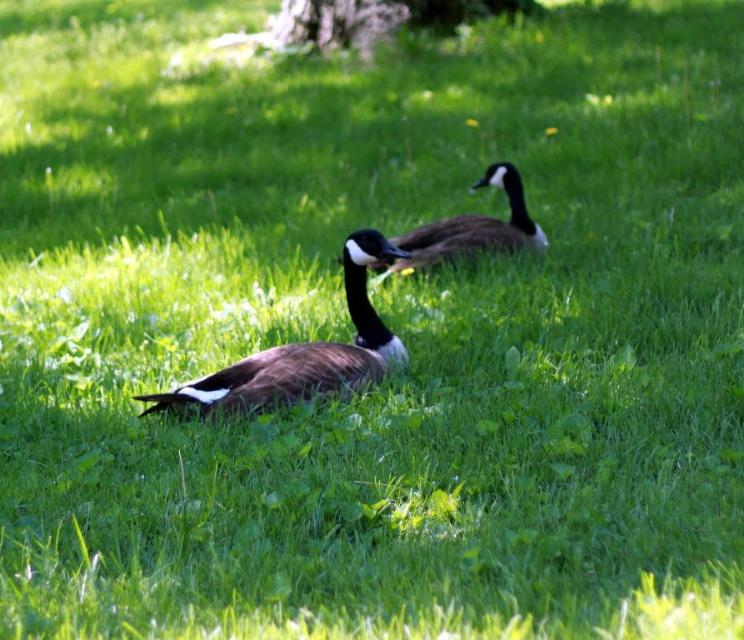
In the scene with a brown matte goose at center and a smooth bark tree at upper center, which object is positioned to the right when viewed from the front?

The smooth bark tree at upper center is positioned to the right of the brown matte goose at center.

You are a photographer trying to capture both the brown matte goose at center and the smooth bark tree at upper center in the same frame. Given that your camera can only focus on objects wider than 10 cm, will both objects meet the focus requirement?

The brown matte goose at center is thinner than the smooth bark tree at upper center. Since the camera requires objects to be wider than 10 cm, the smooth bark tree at upper center is likely wider than 10 cm. However, the brown matte goose at center being thinner might be narrower than 10 cm. Therefore, only the smooth bark tree at upper center meets the focus requirement.

You are standing at the origin point of the image. A brown matte goose at center is located at point (304, 353). If you want to walk towards the brown matte goose at center, which direction should you move in?

To reach the brown matte goose at center located at point (304, 353), you should move northeast.